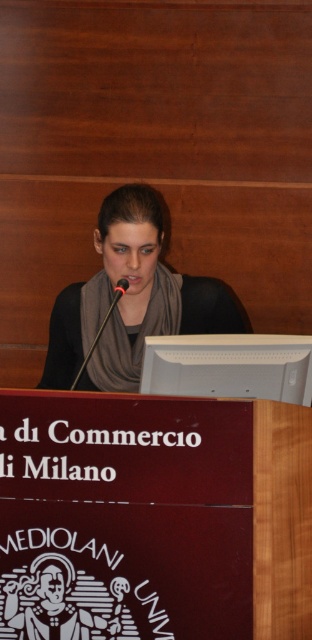
Question: Is matte gray scarf at center bigger than black matte microphone at center?

Choices:
 (A) yes
 (B) no

Answer: (A)

Question: Which point is farther to the camera?

Choices:
 (A) black plastic microphone at center
 (B) matte gray scarf at center

Answer: (B)

Question: Can you confirm if matte gray scarf at center is smaller than black matte microphone at center?

Choices:
 (A) yes
 (B) no

Answer: (B)

Question: Does matte gray scarf at center lie behind black plastic microphone at center?

Choices:
 (A) yes
 (B) no

Answer: (A)

Question: Based on their relative distances, which object is nearer to the matte gray scarf at center?

Choices:
 (A) black plastic microphone at center
 (B) black matte microphone at center

Answer: (A)

Question: Which object appears closest to the camera in this image?

Choices:
 (A) black matte microphone at center
 (B) black plastic microphone at center

Answer: (B)